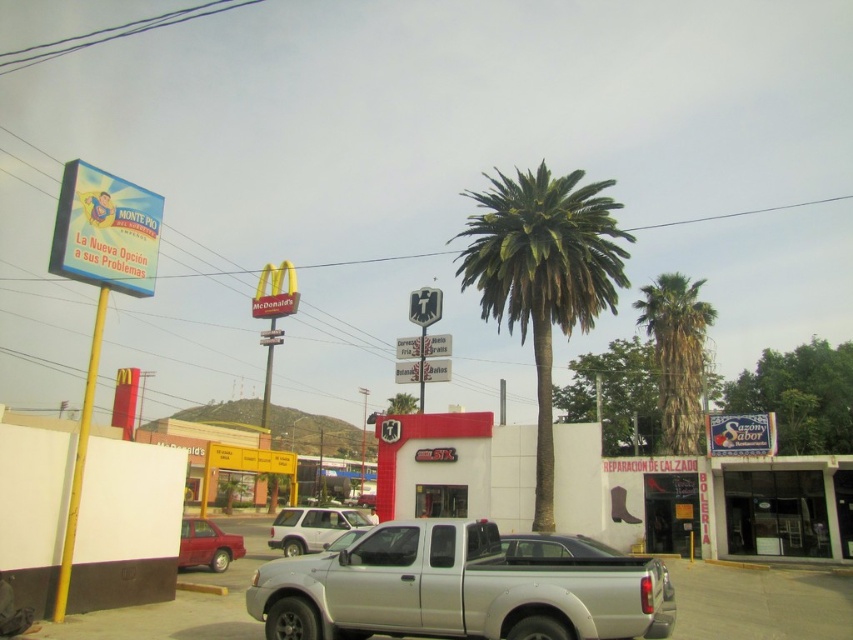
Question: Can you confirm if green leafy palm tree at center is smaller than metallic red sedan at lower left?

Choices:
 (A) yes
 (B) no

Answer: (B)

Question: Is green leafy palm tree at center wider than white matte suv at center?

Choices:
 (A) yes
 (B) no

Answer: (A)

Question: Among these points, which one is nearest to the camera?

Choices:
 (A) (519, 266)
 (B) (207, 548)
 (C) (279, 604)

Answer: (C)

Question: Which object is farther from the camera taking this photo?

Choices:
 (A) metallic red sedan at lower left
 (B) green leafy palm tree at center
 (C) white matte suv at center
 (D) green leafy palm tree at center-right

Answer: (D)

Question: Which point is farther to the camera?

Choices:
 (A) white matte suv at center
 (B) green leafy palm tree at center

Answer: (B)

Question: Is silver metallic pickup truck at center to the right of green leafy palm tree at center-right from the viewer's perspective?

Choices:
 (A) yes
 (B) no

Answer: (B)